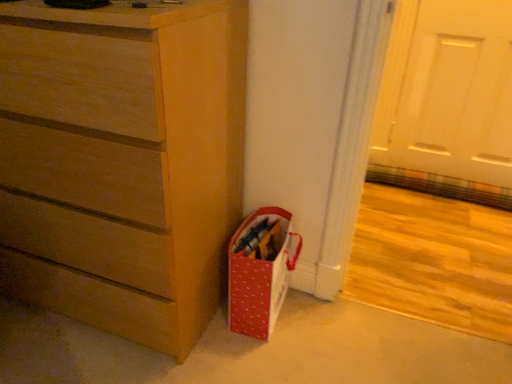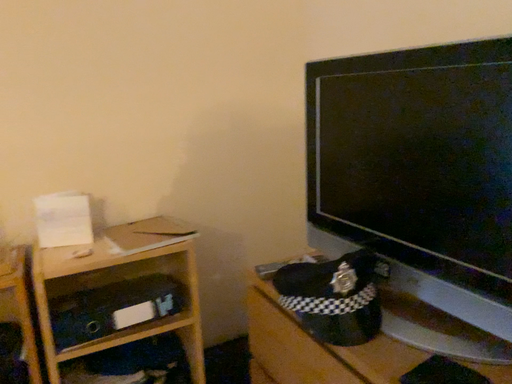
Question: Which way did the camera rotate in the video?

Choices:
 (A) rotated right
 (B) rotated left

Answer: (B)